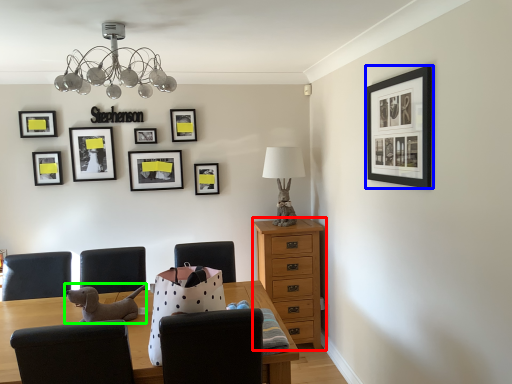
Question: Which object is positioned closest to chest of drawers (highlighted by a red box)? Select from picture frame (highlighted by a blue box) and animal (highlighted by a green box).

Choices:
 (A) picture frame
 (B) animal

Answer: (A)